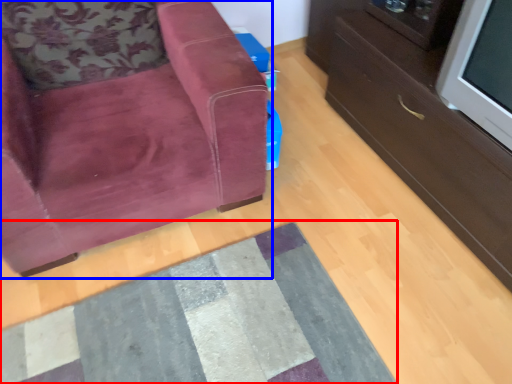
Question: Which object is closer to the camera taking this photo, mat (highlighted by a red box) or chair (highlighted by a blue box)?

Choices:
 (A) mat
 (B) chair

Answer: (B)